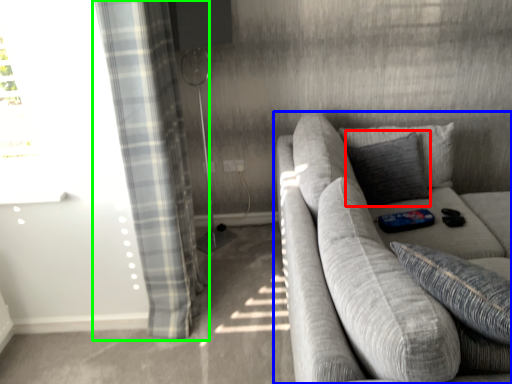
Question: Which is farther away from pillow (highlighted by a red box)? studio couch (highlighted by a blue box) or curtain (highlighted by a green box)?

Choices:
 (A) studio couch
 (B) curtain

Answer: (B)